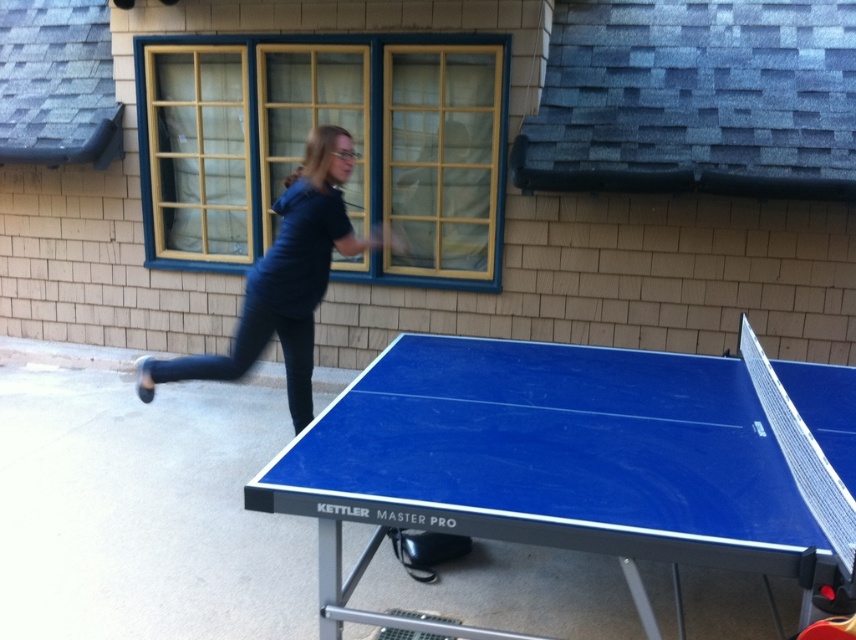
You are a delivery person who needs to place a 5 feet long package between the blue glossy table tennis table at center and the dark blue fabric at upper center. Can you fit it there?

The blue glossy table tennis table at center and dark blue fabric at upper center are 4.51 feet apart from each other. Since the package is 5 feet long, it cannot fit between them as the distance is shorter than the package length.

You are a photographer setting up a shot of the table tennis scene. You need to ensure that the blue glossy table tennis table at center and the dark blue fabric at upper center are both in focus. Given their relative sizes, which object should you adjust your camera focus on first to ensure proper framing?

The blue glossy table tennis table at center is shorter than the dark blue fabric at upper center, so you should focus on the dark blue fabric at upper center first since it is larger in the frame and requires more attention for proper framing.

You are standing in a park and see the blue glossy table tennis table at center. If you want to reach it without moving your feet, can you touch it with your outstretched hand?

The blue glossy table tennis table at center is 6.17 feet from viewer, which is beyond typical human arm reach. You cannot touch it with your outstretched hand.